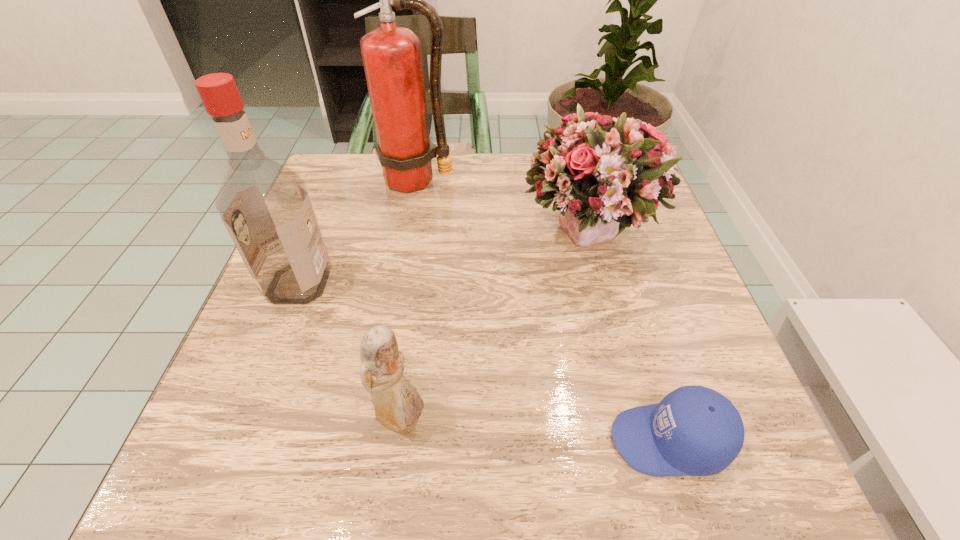
Find the location of a particular element. The height and width of the screenshot is (540, 960). fire extinguisher is located at coordinates (392, 56).

What are the coordinates of `the leftmost object` in the screenshot? It's located at (264, 205).

Identify the location of the third shortest object. This screenshot has height=540, width=960. pyautogui.click(x=604, y=174).

Where is `the fourth tallest object`? The height and width of the screenshot is (540, 960). the fourth tallest object is located at coordinates (398, 406).

Image resolution: width=960 pixels, height=540 pixels. In order to click on cap in this screenshot , I will do `click(693, 431)`.

Image resolution: width=960 pixels, height=540 pixels. I want to click on vacant space located at the nozzle of the fire extinguisher, so click(405, 248).

This screenshot has height=540, width=960. I want to click on free space located on the front-facing side of the liquor, so click(435, 283).

Find the location of a particular element. This screenshot has height=540, width=960. blank space located 0.300m on the left of the bouquet is located at coordinates (386, 235).

Locate an element on the screen. Image resolution: width=960 pixels, height=540 pixels. free region located 0.320m on the front-facing side of the second shortest object is located at coordinates (636, 421).

This screenshot has height=540, width=960. I want to click on vacant area located 0.150m on the front-facing side of the cap, so click(x=511, y=440).